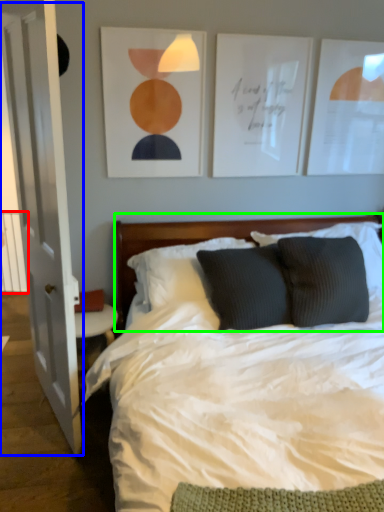
Question: Based on their relative distances, which object is nearer to balustrade (highlighted by a red box)? Choose from glass door (highlighted by a blue box) and headboard (highlighted by a green box).

Choices:
 (A) glass door
 (B) headboard

Answer: (A)